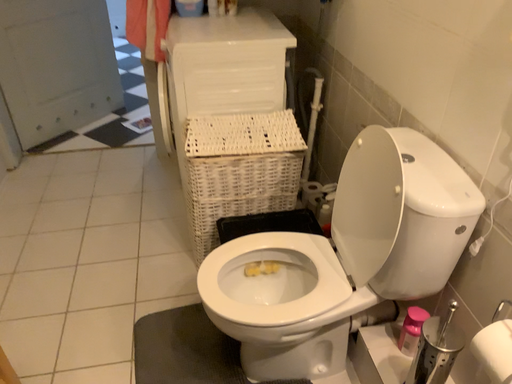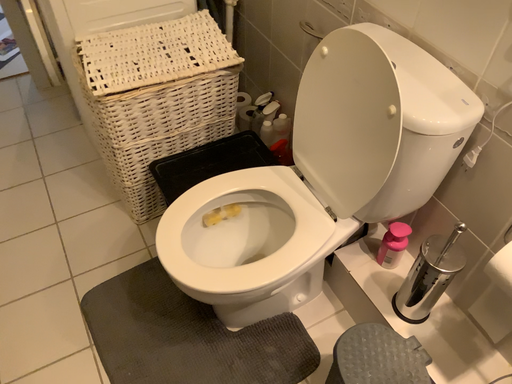
Question: Which way did the camera rotate in the video?

Choices:
 (A) rotated upward
 (B) rotated downward

Answer: (B)